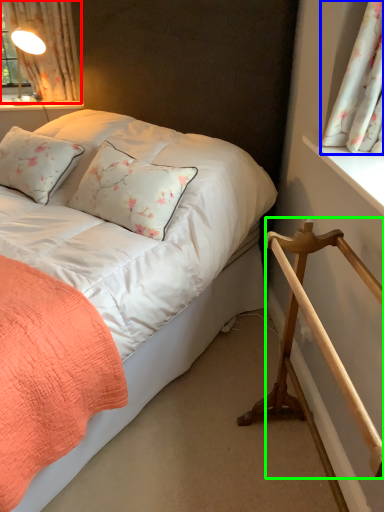
Question: Considering the real-world distances, which object is farthest from curtain (highlighted by a red box)? curtain (highlighted by a blue box) or rail (highlighted by a green box)?

Choices:
 (A) curtain
 (B) rail

Answer: (B)